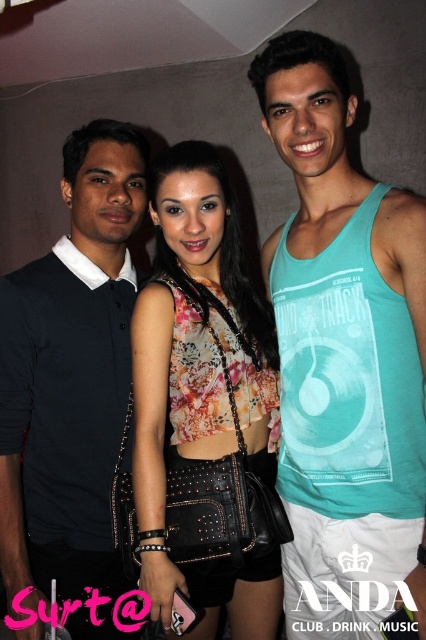
Question: Does teal tank top at center lie behind floral fabric top at center?

Choices:
 (A) no
 (B) yes

Answer: (A)

Question: Which point is closer to the camera taking this photo?

Choices:
 (A) (146, 518)
 (B) (5, 580)
 (C) (290, 65)

Answer: (C)

Question: Which point is closer to the camera?

Choices:
 (A) (103, 564)
 (B) (160, 301)

Answer: (B)

Question: Among these objects, which one is farthest from the camera?

Choices:
 (A) black matte shirt at left
 (B) teal tank top at center

Answer: (A)

Question: Is teal tank top at center smaller than floral fabric top at center?

Choices:
 (A) no
 (B) yes

Answer: (A)

Question: Is teal tank top at center below black matte shirt at left?

Choices:
 (A) yes
 (B) no

Answer: (B)